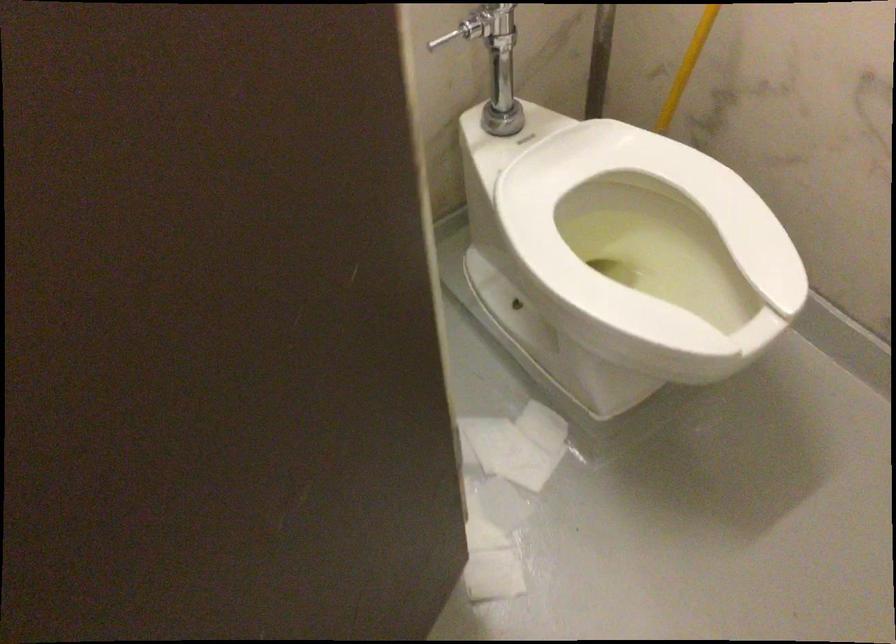
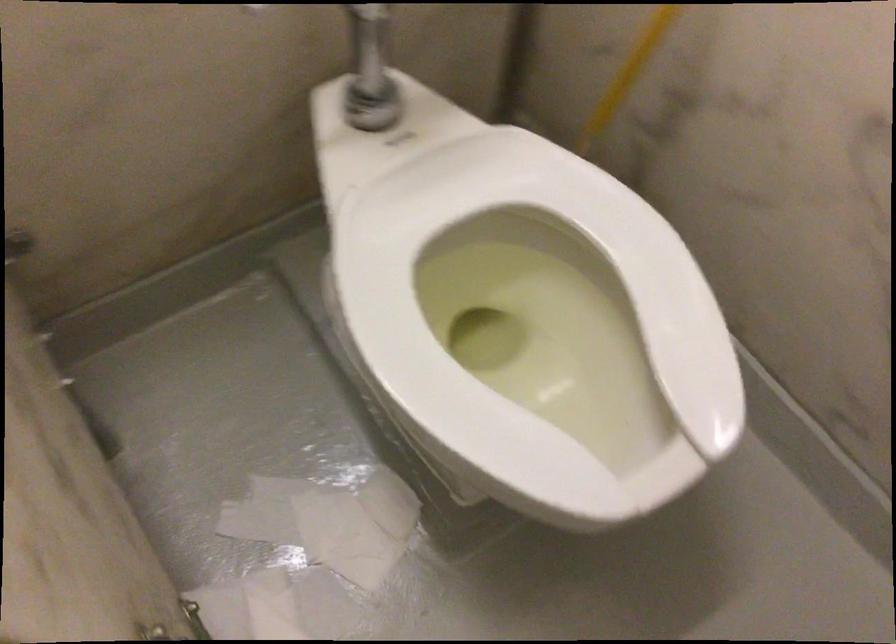
Where in the second image is the point corresponding to the point at 496,109 from the first image?

(362, 96)